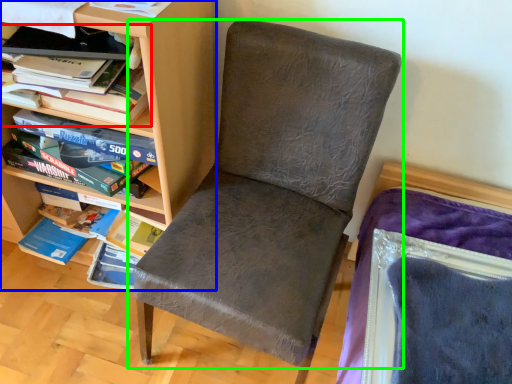
Question: Estimate the real-world distances between objects in this image. Which object is closer to book (highlighted by a red box), shelf (highlighted by a blue box) or chair (highlighted by a green box)?

Choices:
 (A) shelf
 (B) chair

Answer: (A)